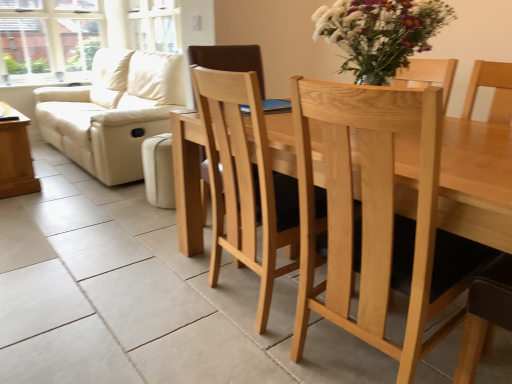
What do you see at coordinates (48, 40) in the screenshot? This screenshot has height=384, width=512. I see `clear glass window at upper left` at bounding box center [48, 40].

What is the approximate height of beige leather couch at left?

beige leather couch at left is 37.70 inches in height.

Describe the element at coordinates (15, 156) in the screenshot. This screenshot has width=512, height=384. I see `wooden side table at left` at that location.

This screenshot has height=384, width=512. I want to click on clear glass window at upper left, so click(48, 40).

Considering the positions of objects clear glass window at upper left and beige leather couch at left in the image provided, who is behind, clear glass window at upper left or beige leather couch at left?

clear glass window at upper left is more distant.

From the image's perspective, which is above, clear glass window at upper left or beige leather couch at left?

clear glass window at upper left is shown above in the image.

Is clear glass window at upper left turned away from beige leather couch at left?

No, beige leather couch at left is not at the back of clear glass window at upper left.

From a real-world perspective, is clear glass window at upper left above or below beige leather couch at left?

In terms of real-world spatial position, clear glass window at upper left is above beige leather couch at left.

Is natural wood chair at center at the left side of beige leather couch at left?

In fact, natural wood chair at center is to the right of beige leather couch at left.

Find the location of a particular element. This screenshot has width=512, height=384. chair below the beige leather couch at left (from a real-world perspective) is located at coordinates pos(376,219).

From the picture: Could you tell me if natural wood chair at center is facing beige leather couch at left?

No.

Would you say natural wood chair at center contains beige leather couch at left?

No.

From a real-world perspective, is wooden side table at left under beige leather couch at left?

Correct, in the physical world, wooden side table at left is lower than beige leather couch at left.

From the image's perspective, is wooden side table at left located above or below beige leather couch at left?

Clearly, from the image's perspective, wooden side table at left is below beige leather couch at left.

Is wooden side table at left located outside beige leather couch at left?

That's correct, wooden side table at left is outside of beige leather couch at left.

Does beige leather couch at left appear on the left side of natural wood chair at center?

Correct, you'll find beige leather couch at left to the left of natural wood chair at center.

Identify the location of chair below the beige leather couch at left (from a real-world perspective). (376, 219).

Is beige leather couch at left oriented away from natural wood chair at center?

No, beige leather couch at left is not facing away from natural wood chair at center.

Would you say beige leather couch at left contains natural wood chair at center?

No, natural wood chair at center is located outside of beige leather couch at left.

Considering the positions of objects clear glass window at upper left and natural wood chair at center in the image provided, who is more to the right, clear glass window at upper left or natural wood chair at center?

natural wood chair at center.

From a real-world perspective, is clear glass window at upper left below natural wood chair at center?

No.

At what (x,y) coordinates should I click in order to perform the action: click on window above the natural wood chair at center (from the image's perspective). Please return your answer as a coordinate pair (x, y). The width and height of the screenshot is (512, 384). Looking at the image, I should click on coord(48,40).

Considering the sizes of objects clear glass window at upper left and natural wood chair at center in the image provided, who is smaller, clear glass window at upper left or natural wood chair at center?

clear glass window at upper left.

In terms of width, does natural wood chair at center look wider or thinner when compared to wooden side table at left?

In the image, natural wood chair at center appears to be wider than wooden side table at left.

Does point (441, 303) lie behind point (11, 123)?

No, it is in front of (11, 123).

Can you confirm if natural wood chair at center is taller than wooden side table at left?

Yes.

Image resolution: width=512 pixels, height=384 pixels. I want to click on table directly beneath the natural wood chair at center (from a real-world perspective), so click(15, 156).

How many degrees apart are the facing directions of beige leather couch at left and wooden side table at left?

0.23 degrees.

Considering the positions of objects beige leather couch at left and wooden side table at left in the image provided, who is more to the right, beige leather couch at left or wooden side table at left?

beige leather couch at left is more to the right.

In terms of width, does beige leather couch at left look wider or thinner when compared to wooden side table at left?

Considering their sizes, beige leather couch at left looks broader than wooden side table at left.

From the image's perspective, is beige leather couch at left located above wooden side table at left?

Yes, from the image's perspective, beige leather couch at left is over wooden side table at left.

The image size is (512, 384). I want to click on window on the left of beige leather couch at left, so (x=48, y=40).

Image resolution: width=512 pixels, height=384 pixels. I want to click on chair below the beige leather couch at left (from a real-world perspective), so click(376, 219).

From the image, which object appears to be nearer to clear glass window at upper left, natural wood chair at center or beige leather couch at left?

Among the two, beige leather couch at left is located nearer to clear glass window at upper left.

Which object lies nearer to the anchor point natural wood chair at center, beige leather couch at left or wooden side table at left?

beige leather couch at left.

From the image, which object appears to be farther from natural wood chair at center, wooden side table at left or beige leather couch at left?

Among the two, wooden side table at left is located further to natural wood chair at center.

Based on their spatial positions, is clear glass window at upper left or wooden side table at left further from beige leather couch at left?

clear glass window at upper left.

Estimate the real-world distances between objects in this image. Which object is further from beige leather couch at left, natural wood chair at center or clear glass window at upper left?

The object further to beige leather couch at left is natural wood chair at center.

Considering their positions, is clear glass window at upper left positioned further to natural wood chair at center than wooden side table at left?

clear glass window at upper left.

Based on their spatial positions, is wooden side table at left or clear glass window at upper left closer to natural wood chair at center?

The object closer to natural wood chair at center is wooden side table at left.

When comparing their distances from wooden side table at left, does clear glass window at upper left or beige leather couch at left seem further?

clear glass window at upper left is positioned further to the anchor wooden side table at left.

The height and width of the screenshot is (384, 512). I want to click on studio couch located between wooden side table at left and natural wood chair at center in the left-right direction, so point(113,111).

Where is `studio couch between natural wood chair at center and clear glass window at upper left along the z-axis`? Image resolution: width=512 pixels, height=384 pixels. studio couch between natural wood chair at center and clear glass window at upper left along the z-axis is located at coordinates (113, 111).

At what (x,y) coordinates should I click in order to perform the action: click on table between natural wood chair at center and clear glass window at upper left in the front-back direction. Please return your answer as a coordinate pair (x, y). Looking at the image, I should click on (15, 156).

The image size is (512, 384). I want to click on table between beige leather couch at left and clear glass window at upper left from front to back, so click(x=15, y=156).